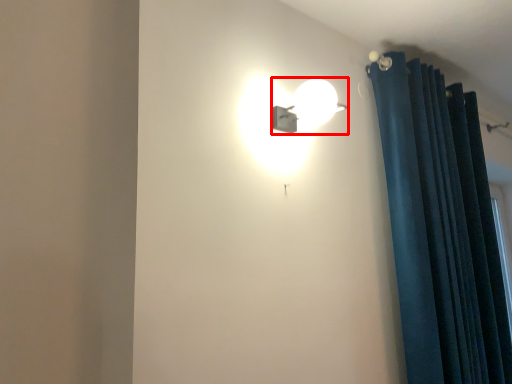
Question: From the image's perspective, what is the correct spatial relationship of lamp (annotated by the red box) in relation to curtain?

Choices:
 (A) below
 (B) above

Answer: (B)